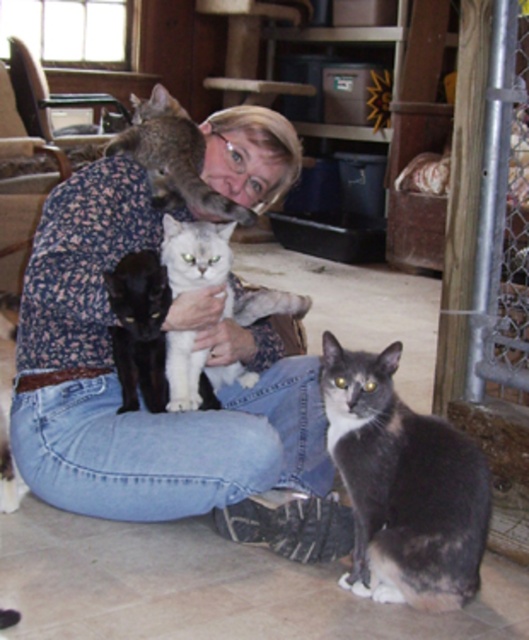
Which is more to the left, fluffy gray cat at upper center or white fluffy cat at center?

From the viewer's perspective, fluffy gray cat at upper center appears more on the left side.

Which of these two, fluffy gray cat at upper center or white fluffy cat at center, stands taller?

Standing taller between the two is white fluffy cat at center.

Find the location of a particular element. Image resolution: width=529 pixels, height=640 pixels. fluffy gray cat at upper center is located at coordinates (174, 157).

What are the coordinates of `fluffy gray cat at upper center` in the screenshot? It's located at (174, 157).

Is floral print shirt at center below black fur cat at left?

No, floral print shirt at center is not below black fur cat at left.

Is floral print shirt at center taller than black fur cat at left?

Yes, floral print shirt at center is taller than black fur cat at left.

Is point (218, 157) closer to camera compared to point (141, 289)?

No, it is not.

The width and height of the screenshot is (529, 640). Find the location of `floral print shirt at center`. floral print shirt at center is located at coordinates (161, 413).

Can you confirm if gray fur cat at center is thinner than white fluffy cat at center?

In fact, gray fur cat at center might be wider than white fluffy cat at center.

Which of these two, gray fur cat at center or white fluffy cat at center, stands shorter?

white fluffy cat at center

Describe the element at coordinates (404, 484) in the screenshot. I see `gray fur cat at center` at that location.

At what (x,y) coordinates should I click in order to perform the action: click on gray fur cat at center. Please return your answer as a coordinate pair (x, y). The image size is (529, 640). Looking at the image, I should click on (404, 484).